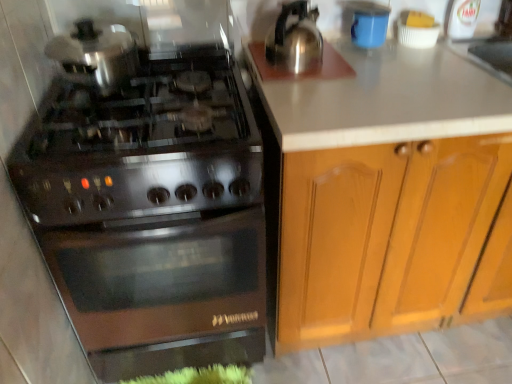
Question: Considering the relative positions of blue matte cup at upper right and stainless steel gas stove at left in the image provided, is blue matte cup at upper right behind stainless steel gas stove at left?

Choices:
 (A) yes
 (B) no

Answer: (A)

Question: From the image's perspective, is blue matte cup at upper right on top of stainless steel gas stove at left?

Choices:
 (A) no
 (B) yes

Answer: (B)

Question: Is blue matte cup at upper right directly adjacent to stainless steel gas stove at left?

Choices:
 (A) no
 (B) yes

Answer: (A)

Question: Can you confirm if blue matte cup at upper right is positioned to the right of stainless steel gas stove at left?

Choices:
 (A) yes
 (B) no

Answer: (A)

Question: Is blue matte cup at upper right at the left side of stainless steel gas stove at left?

Choices:
 (A) yes
 (B) no

Answer: (B)

Question: Is blue matte cup at upper right located outside stainless steel gas stove at left?

Choices:
 (A) no
 (B) yes

Answer: (B)

Question: Can you confirm if stainless steel gas stove at left is smaller than wooden cabinet at right?

Choices:
 (A) yes
 (B) no

Answer: (A)

Question: Is stainless steel gas stove at left outside wooden cabinet at right?

Choices:
 (A) yes
 (B) no

Answer: (A)

Question: Is stainless steel gas stove at left aimed at wooden cabinet at right?

Choices:
 (A) yes
 (B) no

Answer: (B)

Question: Does stainless steel gas stove at left lie in front of wooden cabinet at right?

Choices:
 (A) no
 (B) yes

Answer: (B)

Question: Can wooden cabinet at right be found inside stainless steel gas stove at left?

Choices:
 (A) no
 (B) yes

Answer: (A)

Question: Are stainless steel gas stove at left and wooden cabinet at right located far from each other?

Choices:
 (A) no
 (B) yes

Answer: (A)

Question: From a real-world perspective, is wooden cabinet at right positioned under stainless steel gas stove at left based on gravity?

Choices:
 (A) yes
 (B) no

Answer: (A)